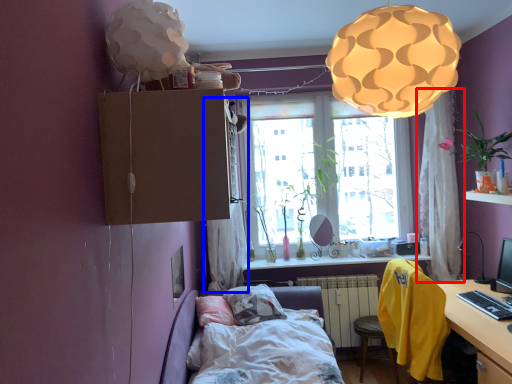
Question: Among these objects, which one is nearest to the camera, curtain (highlighted by a red box) or curtain (highlighted by a blue box)?

Choices:
 (A) curtain
 (B) curtain

Answer: (B)